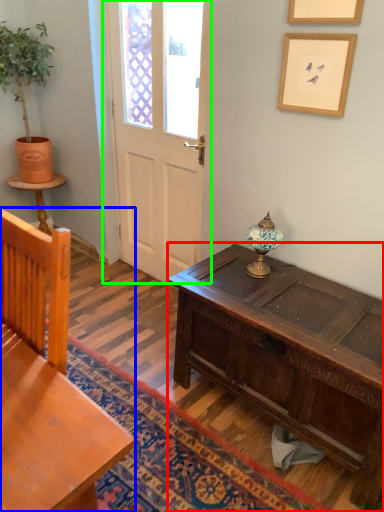
Question: Considering the real-world distances, which object is closest to desk (highlighted by a red box)? chair (highlighted by a blue box) or door (highlighted by a green box).

Choices:
 (A) chair
 (B) door

Answer: (A)